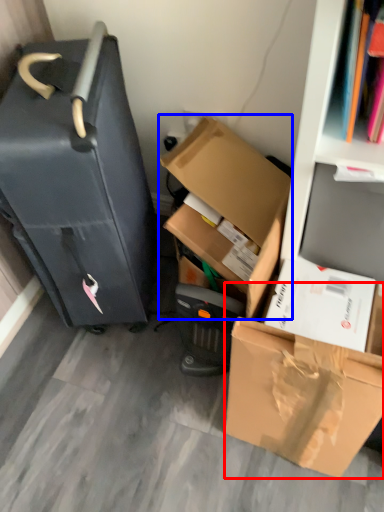
Question: Which point is closer to the camera, box (highlighted by a red box) or box (highlighted by a blue box)?

Choices:
 (A) box
 (B) box

Answer: (A)